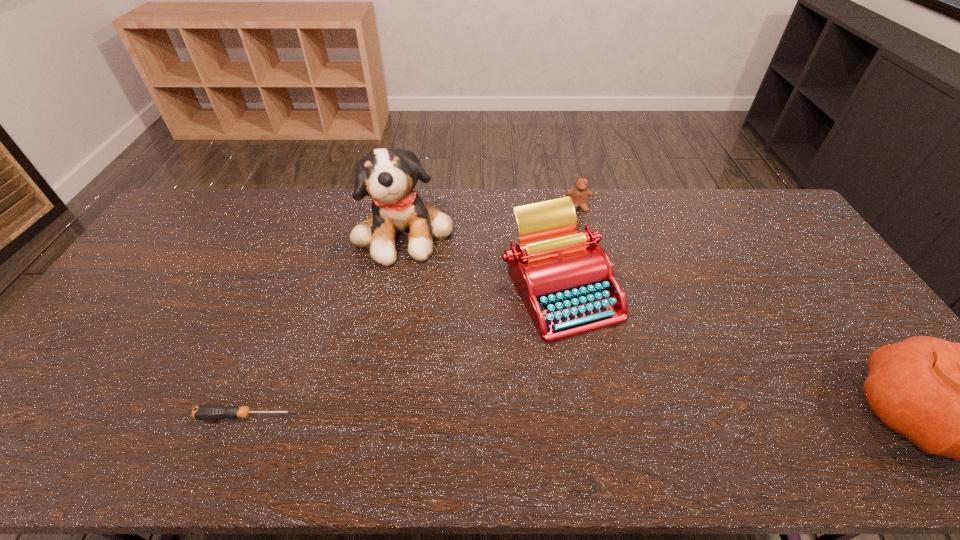
Identify the location of free space located 0.150m on the face of the fourth tallest object. [x=583, y=242].

Locate an element on the screen. This screenshot has height=540, width=960. vacant space located 0.400m on the face of the fourth tallest object is located at coordinates (589, 298).

The height and width of the screenshot is (540, 960). Identify the location of free space located on the typing side of the typewriter. (551, 403).

Find the location of a particular element. The width and height of the screenshot is (960, 540). vacant space situated on the typing side of the typewriter is located at coordinates (553, 388).

This screenshot has height=540, width=960. What are the coordinates of `blank space located 0.320m at the face of the second object from left to right` in the screenshot? It's located at (458, 341).

At what (x,y) coordinates should I click in order to perform the action: click on vacant space situated at the face of the second object from left to right. Please return your answer as a coordinate pair (x, y). Looking at the image, I should click on (466, 359).

Identify the location of vacant space positioned 0.340m at the face of the second object from left to right. (460, 347).

At what (x,y) coordinates should I click in order to perform the action: click on teddy bear that is at the far edge. Please return your answer as a coordinate pair (x, y). Image resolution: width=960 pixels, height=540 pixels. Looking at the image, I should click on (579, 195).

At what (x,y) coordinates should I click in order to perform the action: click on puppy that is at the far edge. Please return your answer as a coordinate pair (x, y). Looking at the image, I should click on (388, 176).

You are a GUI agent. You are given a task and a screenshot of the screen. Output one action in this format:
    pyautogui.click(x=<x>, y=<y>)
    Task: Click on the object located at the near edge
    The height and width of the screenshot is (540, 960).
    Given the screenshot: What is the action you would take?
    pos(208,411)